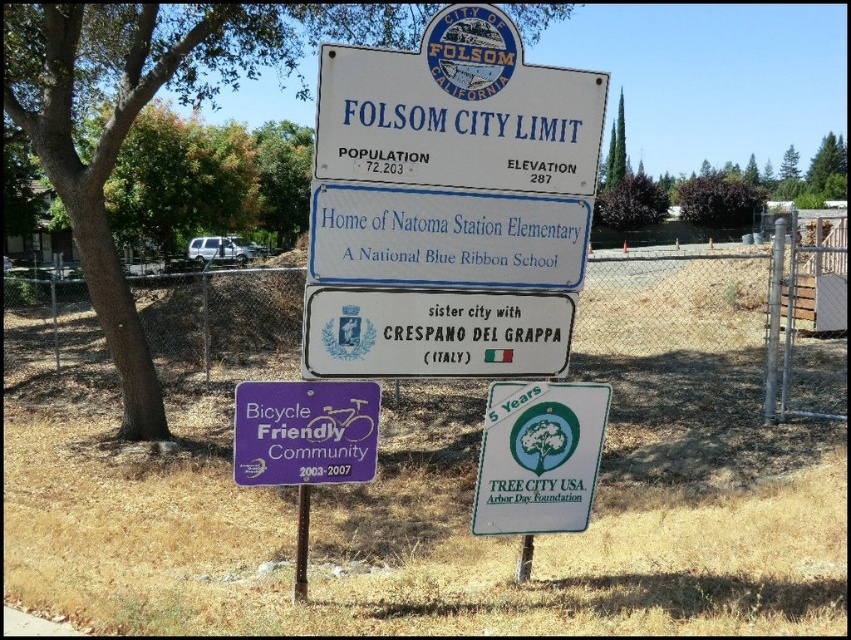
You are standing at the entrance of Folsom City and see two points marked on the signs. The first point is at coordinate point(414, 291) and the second is at point(238, 445). Which point is closer to you?

Point(414, 291) is closer to you because it is in front of point(238, 445).

You are a cyclist approaching Folsom City and see the white metallic sign at center and the purple plastic bicycle friendly community sign at lower center. Which sign should you look at first to check for elevation information?

The white metallic sign at center is located above the purple plastic bicycle friendly community sign at lower center. Since elevation information is typically placed on the main city limit signs, you should check the white metallic sign at center first for elevation details.